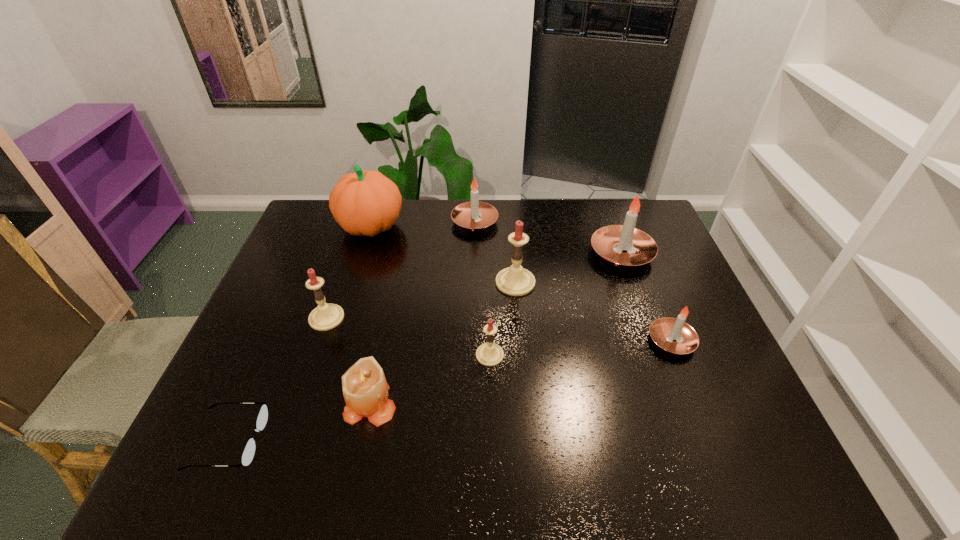
Locate an element on the screen. the third closest red candle to the beige candle is located at coordinates (515, 280).

Locate an element on the screen. This screenshot has width=960, height=540. free spot that satisfies the following two spatial constraints: 1. on the front side of the smallest white candle; 2. on the left side of the second smallest white candle is located at coordinates (473, 341).

Find the location of `free space that satisfies the following two spatial constraints: 1. on the back side of the biggest white candle; 2. on the right side of the farthest red candle`. free space that satisfies the following two spatial constraints: 1. on the back side of the biggest white candle; 2. on the right side of the farthest red candle is located at coordinates (513, 253).

You are a GUI agent. You are given a task and a screenshot of the screen. Output one action in this format:
    pyautogui.click(x=<x>, y=<y>)
    Task: Click on the free location that satisfies the following two spatial constraints: 1. on the front side of the farthest red candle; 2. on the left side of the second biggest white candle
    This screenshot has height=540, width=960.
    Given the screenshot: What is the action you would take?
    pyautogui.click(x=474, y=282)